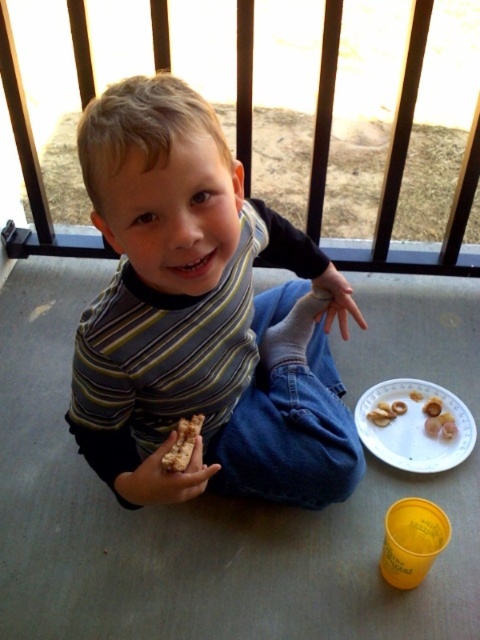
I want to click on white paper plate at lower right, so click(x=414, y=428).

Is white paper plate at lower right smaller than white matte crackers at lower right?

No, white paper plate at lower right is not smaller than white matte crackers at lower right.

Which is behind, point (421, 380) or point (454, 424)?

Positioned behind is point (421, 380).

The image size is (480, 640). In order to click on white paper plate at lower right in this screenshot , I will do `click(414, 428)`.

Can you confirm if black metal rail at upper center is bigger than white matte crackers at lower right?

Yes, black metal rail at upper center is bigger than white matte crackers at lower right.

Who is more distant from viewer, (315, 208) or (441, 433)?

Point (315, 208)

Which is behind, point (336, 35) or point (392, 404)?

The point (392, 404) is behind.

This screenshot has width=480, height=640. I want to click on black metal rail at upper center, so click(267, 115).

Measure the distance between point (x=425, y=419) and camera.

Point (x=425, y=419) is 1.41 meters from camera.

Does point (385, 426) come closer to viewer compared to point (181, 428)?

No, it is not.

You are a GUI agent. You are given a task and a screenshot of the screen. Output one action in this format:
    pyautogui.click(x=<x>, y=<y>)
    Task: Click on the white matte crackers at lower right
    
    Given the screenshot: What is the action you would take?
    pyautogui.click(x=437, y=419)